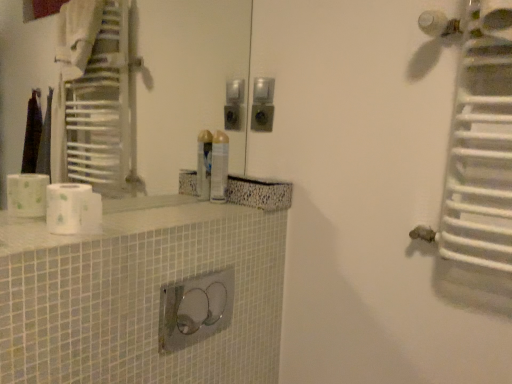
Locate an element on the screen. free space above white glossy counter top at center (from a real-world perspective) is located at coordinates (174, 211).